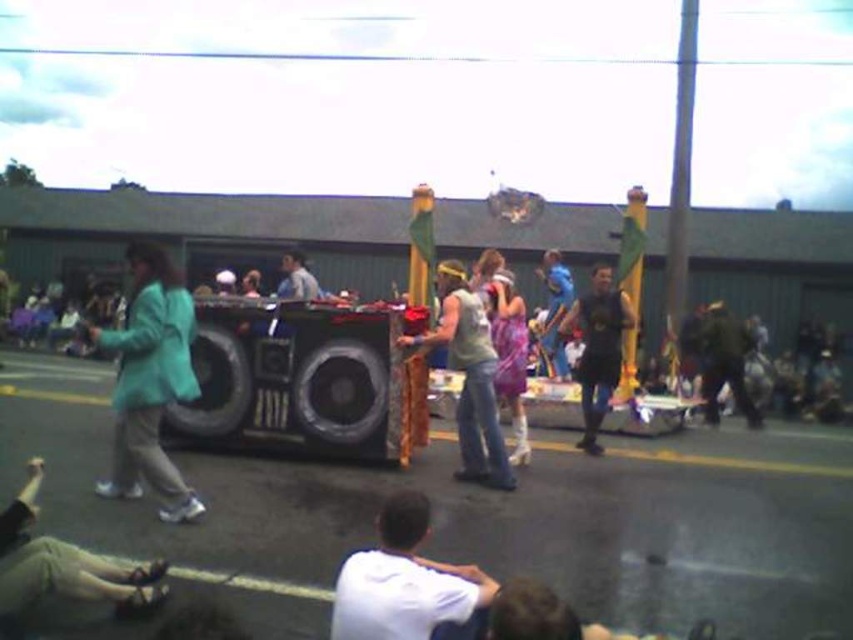
Question: Among these points, which one is nearest to the camera?

Choices:
 (A) (349, 621)
 (B) (363, 396)

Answer: (A)

Question: Considering the relative positions of matte gold fabric at center and light blue shirt at center in the image provided, where is matte gold fabric at center located with respect to light blue shirt at center?

Choices:
 (A) below
 (B) above

Answer: (A)

Question: Among these objects, which one is nearest to the camera?

Choices:
 (A) light blue shirt at center
 (B) dark green fabric jacket at right

Answer: (A)

Question: Does matte gold fabric at center have a lesser width compared to black matte tank top at center?

Choices:
 (A) yes
 (B) no

Answer: (B)

Question: Which of these objects is positioned closest to the shiny black speaker at center?

Choices:
 (A) dark green fabric jacket at right
 (B) matte gold fabric at center

Answer: (B)

Question: Does matte gold fabric at center appear over dark green fabric jacket at right?

Choices:
 (A) yes
 (B) no

Answer: (A)